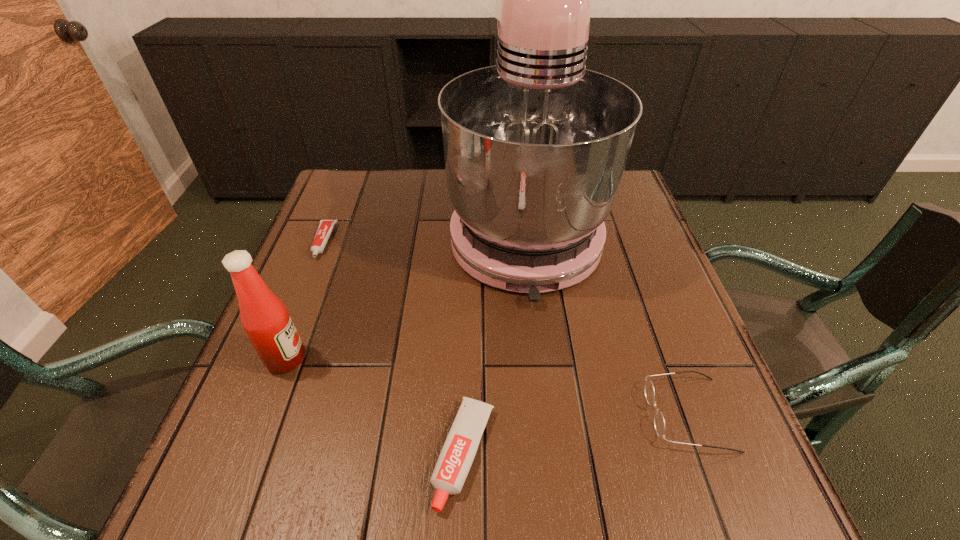
You are a GUI agent. You are given a task and a screenshot of the screen. Output one action in this format:
    pyautogui.click(x=<x>, y=<y>)
    Task: Click on the spectacles that is at the right edge
    Image resolution: width=960 pixels, height=540 pixels.
    Given the screenshot: What is the action you would take?
    pyautogui.click(x=659, y=423)

The width and height of the screenshot is (960, 540). I want to click on object located in the far right corner section of the desktop, so click(535, 147).

Where is `free space at the far edge of the desktop`? This screenshot has width=960, height=540. free space at the far edge of the desktop is located at coordinates (402, 180).

At what (x,y) coordinates should I click in order to perform the action: click on vacant space at the near edge of the desktop. Please return your answer as a coordinate pair (x, y). The width and height of the screenshot is (960, 540). Looking at the image, I should click on (326, 492).

The height and width of the screenshot is (540, 960). What are the coordinates of `vacant area at the left edge of the desktop` in the screenshot? It's located at (314, 221).

Image resolution: width=960 pixels, height=540 pixels. I want to click on vacant space at the right edge, so [x=675, y=448].

The height and width of the screenshot is (540, 960). Find the location of `free space at the near left corner of the desktop`. free space at the near left corner of the desktop is located at coordinates (272, 489).

In the image, there is a desktop. Where is `free region at the near right corner`? free region at the near right corner is located at coordinates (684, 477).

In order to click on blank region between the mixer and the right toothpaste in this screenshot , I will do `click(494, 341)`.

Locate an element on the screen. Image resolution: width=960 pixels, height=540 pixels. vacant area between the shorter toothpaste and the second tallest object is located at coordinates (304, 300).